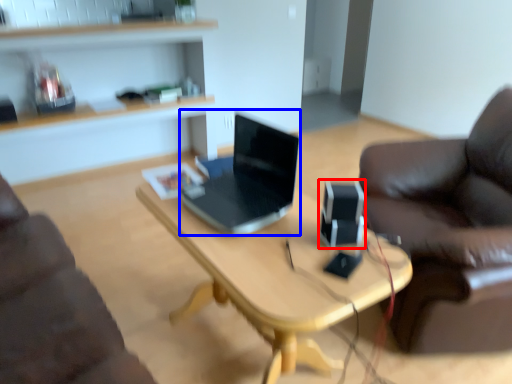
Question: Which object appears closest to the camera in this image, speaker (highlighted by a red box) or laptop (highlighted by a blue box)?

Choices:
 (A) speaker
 (B) laptop

Answer: (B)